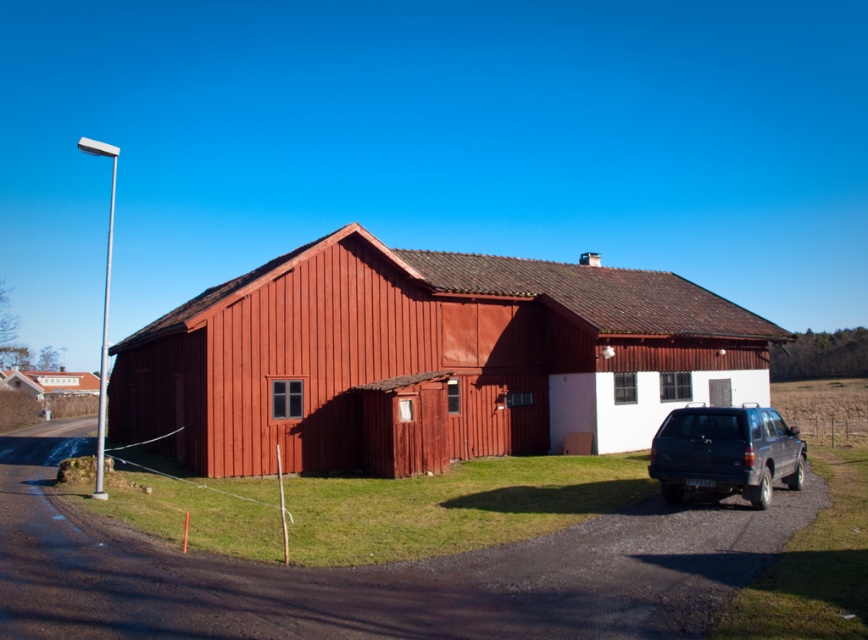
Question: Among these points, which one is nearest to the camera?

Choices:
 (A) tap(409, 333)
 (B) tap(722, 490)

Answer: (B)

Question: Is smooth wooden barn at center thinner than matte black suv at lower right?

Choices:
 (A) yes
 (B) no

Answer: (B)

Question: Which object is farther from the camera taking this photo?

Choices:
 (A) smooth wooden barn at center
 (B) matte black suv at lower right

Answer: (A)

Question: Considering the relative positions of smooth wooden barn at center and matte black suv at lower right in the image provided, where is smooth wooden barn at center located with respect to matte black suv at lower right?

Choices:
 (A) left
 (B) right

Answer: (A)

Question: Can you confirm if smooth wooden barn at center is smaller than matte black suv at lower right?

Choices:
 (A) yes
 (B) no

Answer: (B)